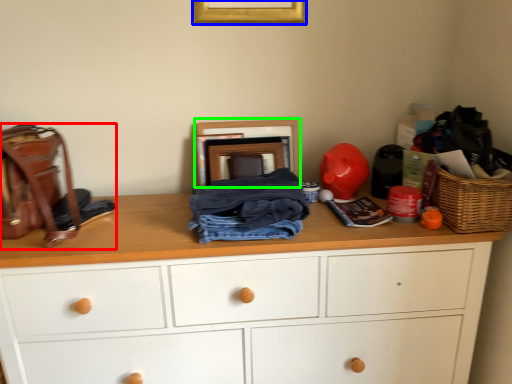
Question: Which object is positioned closest to handbag (highlighted by a red box)? Select from picture frame (highlighted by a blue box) and picture frame (highlighted by a green box).

Choices:
 (A) picture frame
 (B) picture frame

Answer: (B)